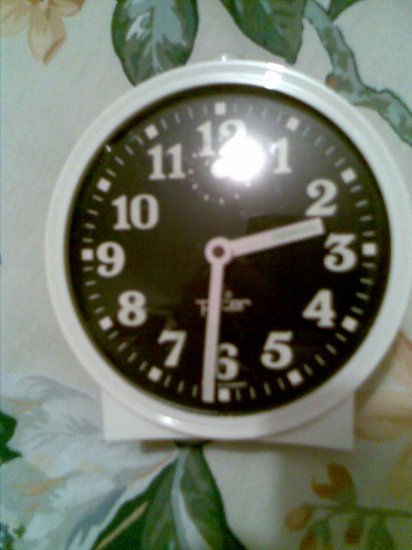
Locate an element on the screen. white clock frame is located at coordinates (333, 415).